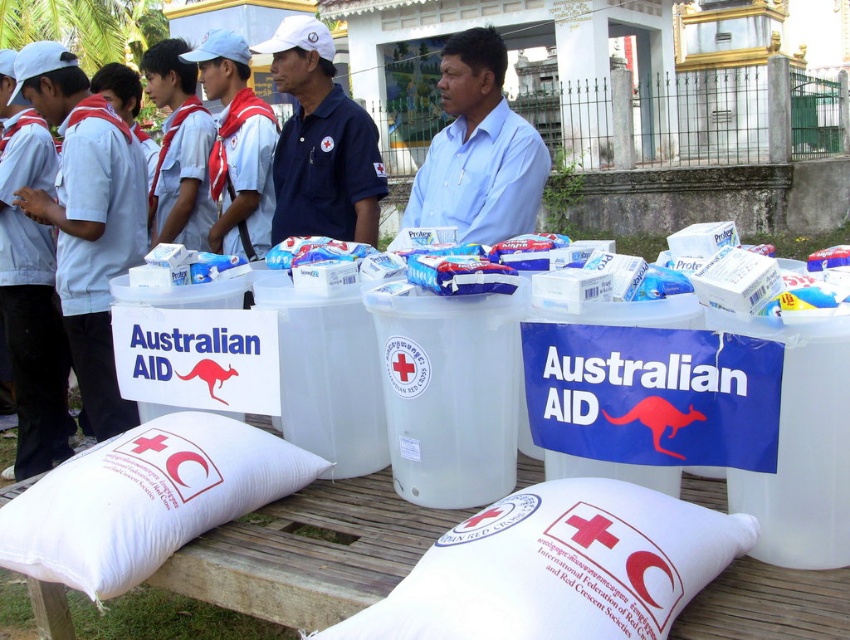
You are a volunteer at the aid distribution event. You need to place a new box on top of the white fabric pillow at lower left. Can you do this without the box touching the white cotton shirt at center?

The white fabric pillow at lower left is not as tall as the white cotton shirt at center. Since the pillow is shorter, placing a box on top of it may not reach the height of the shirt. However, the exact distance between them isn

You are a delivery person who needs to place a package between the white fabric pillow at lower center and the white cotton shirt at center. The package is 1.5 meters long. Is there enough space between them to place the package?

The distance between the white fabric pillow at lower center and the white cotton shirt at center is 3.22 meters. Since the package is 1.5 meters long, there is sufficient space to place it between them.